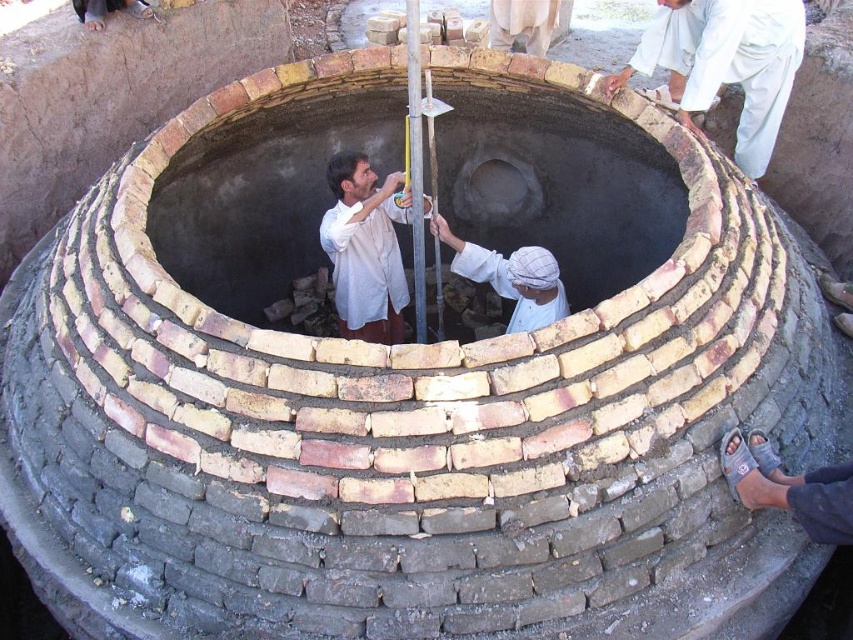
Is white matte shirt at center positioned at the back of white cloth at center?

Yes.

Does white matte shirt at center have a larger size compared to white cloth at center?

Yes.

Image resolution: width=853 pixels, height=640 pixels. In order to click on white matte shirt at center in this screenshot , I will do `click(366, 248)`.

Identify the location of white matte shirt at center. (366, 248).

Does brick oven at center appear on the left side of white cloth at center?

No, brick oven at center is not to the left of white cloth at center.

Consider the image. Between brick oven at center and white cloth at center, which one has less height?

white cloth at center is shorter.

Is point (299, 275) farther from viewer compared to point (540, 275)?

Yes, it is.

The image size is (853, 640). Find the location of `brick oven at center`. brick oven at center is located at coordinates (560, 186).

Looking at this image, is white cotton shirt at upper right above white matte shirt at center?

Yes.

Does white cotton shirt at upper right have a greater height compared to white matte shirt at center?

Incorrect, white cotton shirt at upper right's height is not larger of white matte shirt at center's.

You are a GUI agent. You are given a task and a screenshot of the screen. Output one action in this format:
    pyautogui.click(x=<x>, y=<y>)
    Task: Click on the white cotton shirt at upper right
    The width and height of the screenshot is (853, 640).
    Given the screenshot: What is the action you would take?
    pyautogui.click(x=723, y=65)